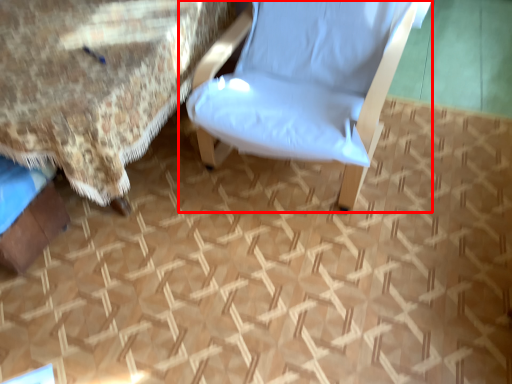
Question: Considering the relative positions of chair (annotated by the red box) and bed in the image provided, where is chair (annotated by the red box) located with respect to the staircase?

Choices:
 (A) right
 (B) left

Answer: (A)